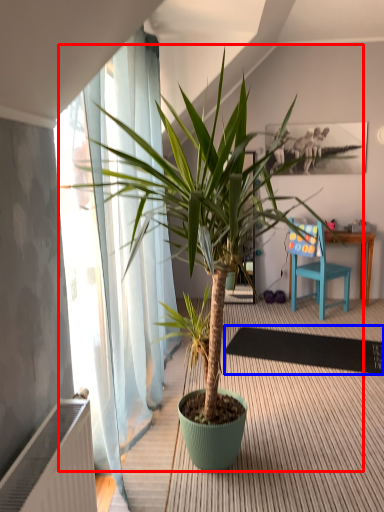
Question: Which object appears closest to the camera in this image, houseplant (highlighted by a red box) or mat (highlighted by a blue box)?

Choices:
 (A) houseplant
 (B) mat

Answer: (A)